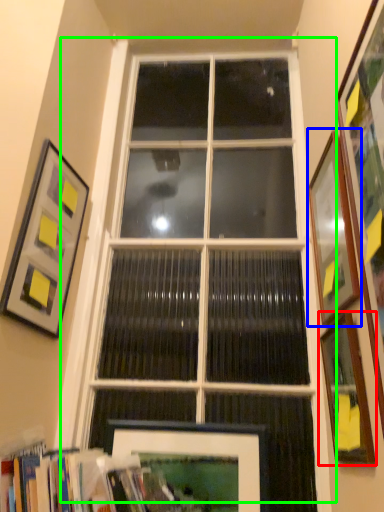
Question: Which object is positioned closest to picture frame (highlighted by a red box)? Select from picture frame (highlighted by a blue box) and window (highlighted by a green box).

Choices:
 (A) picture frame
 (B) window

Answer: (A)